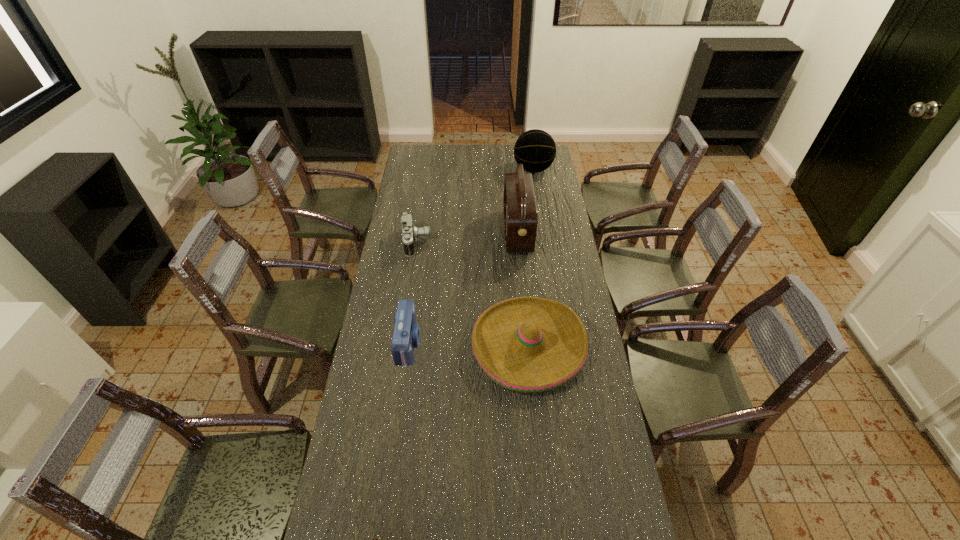
You are a GUI agent. You are given a task and a screenshot of the screen. Output one action in this format:
    pyautogui.click(x=<x>, y=<y>)
    Task: Click on the free space that satisfies the following two spatial constraints: 1. on the front panel of the sombrero; 2. on the right side of the tallest object
    The height and width of the screenshot is (540, 960).
    Given the screenshot: What is the action you would take?
    pyautogui.click(x=527, y=346)

This screenshot has height=540, width=960. Identify the location of vacant area that satisfies the following two spatial constraints: 1. on the front panel of the tallest object; 2. on the back side of the sombrero. (527, 346).